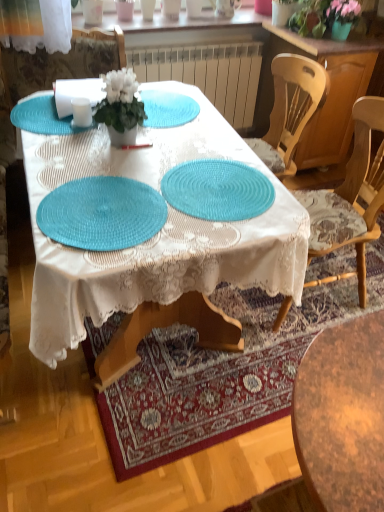
At what (x,y) coordinates should I click in order to perform the action: click on vacant area situated below teal woven placemat at center, which ranks as the second glass plate in top-to-bottom order (from a real-world perspective). Please return your answer as a coordinate pair (x, y). Image resolution: width=384 pixels, height=512 pixels. Looking at the image, I should click on (221, 188).